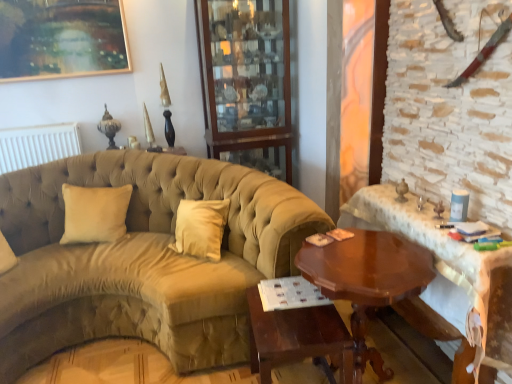
Question: Can you confirm if shiny brown wood table at right, which is counted as the 2th table, starting from the right, is taller than suede-like beige couch at center?

Choices:
 (A) yes
 (B) no

Answer: (B)

Question: Can you confirm if shiny brown wood table at right, the 2th table in the left-to-right sequence, is smaller than suede-like beige couch at center?

Choices:
 (A) no
 (B) yes

Answer: (B)

Question: Can you confirm if shiny brown wood table at right, which is counted as the 2th table, starting from the right, is positioned to the right of suede-like beige couch at center?

Choices:
 (A) no
 (B) yes

Answer: (B)

Question: From a real-world perspective, is shiny brown wood table at right, which is counted as the 2th table, starting from the right, on top of suede-like beige couch at center?

Choices:
 (A) yes
 (B) no

Answer: (B)

Question: From the image's perspective, would you say shiny brown wood table at right, the 2th table in the left-to-right sequence, is shown under suede-like beige couch at center?

Choices:
 (A) no
 (B) yes

Answer: (B)

Question: Looking at their shapes, would you say mahogany wood table at center, acting as the third table starting from the right, is wider or thinner than beige velvet pillow at left?

Choices:
 (A) thin
 (B) wide

Answer: (B)

Question: Relative to beige velvet pillow at left, is mahogany wood table at center, acting as the third table starting from the right, in front or behind?

Choices:
 (A) behind
 (B) front

Answer: (B)

Question: From the image's perspective, is mahogany wood table at center, acting as the third table starting from the right, above or below beige velvet pillow at left?

Choices:
 (A) below
 (B) above

Answer: (A)

Question: From a real-world perspective, is mahogany wood table at center, acting as the third table starting from the right, above or below beige velvet pillow at left?

Choices:
 (A) below
 (B) above

Answer: (A)

Question: From a real-world perspective, is beige velvet pillow at left positioned above or below gold-framed painting at upper left?

Choices:
 (A) above
 (B) below

Answer: (B)

Question: From their relative heights in the image, would you say beige velvet pillow at left is taller or shorter than gold-framed painting at upper left?

Choices:
 (A) tall
 (B) short

Answer: (B)

Question: Is beige velvet pillow at left situated inside gold-framed painting at upper left or outside?

Choices:
 (A) inside
 (B) outside

Answer: (B)

Question: Visually, is beige velvet pillow at left positioned to the left or to the right of gold-framed painting at upper left?

Choices:
 (A) left
 (B) right

Answer: (B)

Question: Is beige velvet pillow at left wider or thinner than suede-like beige couch at center?

Choices:
 (A) thin
 (B) wide

Answer: (A)

Question: Would you say beige velvet pillow at left is to the left or to the right of suede-like beige couch at center in the picture?

Choices:
 (A) right
 (B) left

Answer: (B)